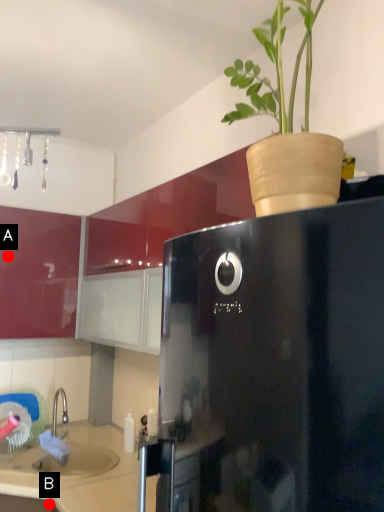
Question: Two points are circled on the image, labeled by A and B beside each circle. Which point is further to the camera?

Choices:
 (A) A is further
 (B) B is further

Answer: (A)